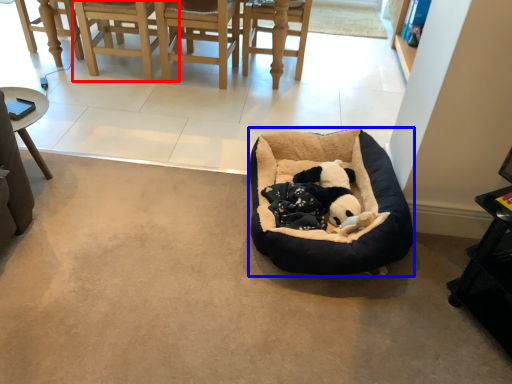
Question: Among these objects, which one is nearest to the camera, chair (highlighted by a red box) or dog bed (highlighted by a blue box)?

Choices:
 (A) chair
 (B) dog bed

Answer: (B)